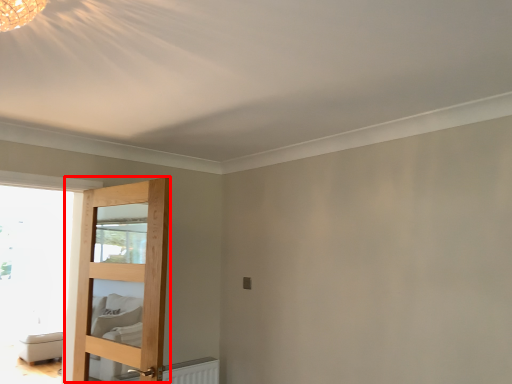
Question: From the image's perspective, considering the relative positions of door (annotated by the red box) and furniture in the image provided, where is door (annotated by the red box) located with respect to the staircase?

Choices:
 (A) below
 (B) above

Answer: (B)